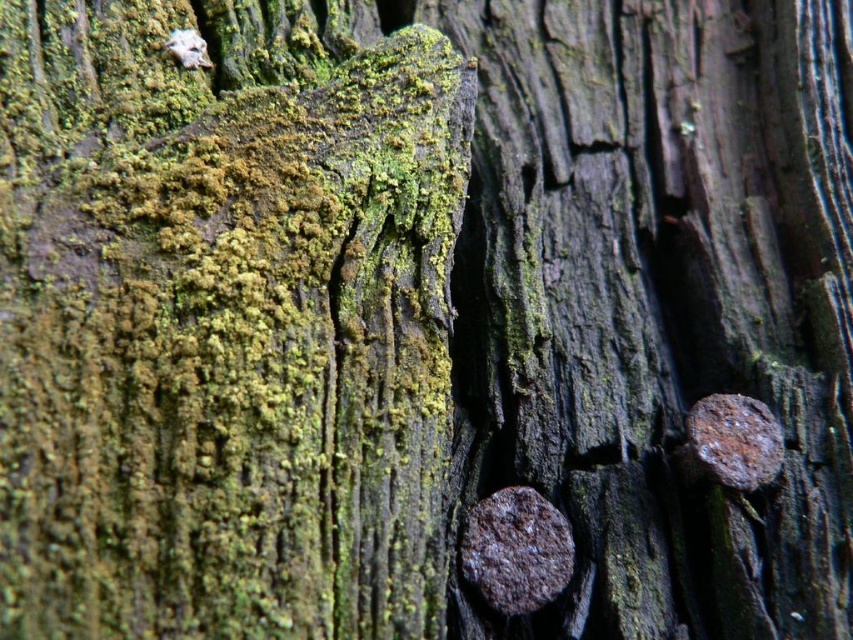
Question: Can you confirm if rusty metallic nail at lower right is wider than rusty metal nail at right?

Choices:
 (A) no
 (B) yes

Answer: (B)

Question: Which of the following is the closest to the observer?

Choices:
 (A) (526, 541)
 (B) (712, 480)

Answer: (A)

Question: Is rusty metallic nail at lower right positioned in front of rusty metal nail at right?

Choices:
 (A) no
 (B) yes

Answer: (B)

Question: Is rusty metallic nail at lower right closer to camera compared to rusty metal nail at right?

Choices:
 (A) no
 (B) yes

Answer: (B)